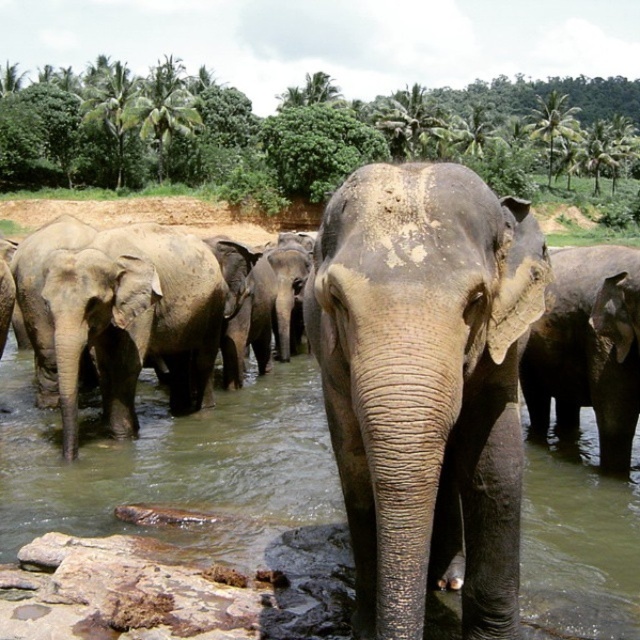
Does point (156, 314) lie in front of point (616, 474)?

No, (156, 314) is further to viewer.

Between gray matte elephant at left and gray textured elephant at center, which one appears on the left side from the viewer's perspective?

From the viewer's perspective, gray matte elephant at left appears more on the left side.

This screenshot has height=640, width=640. I want to click on gray matte elephant at left, so click(x=134, y=321).

The image size is (640, 640). Identify the location of gray matte elephant at left. (134, 321).

Does gray matte elephant at center have a greater width compared to brown muddy water at center?

Yes, gray matte elephant at center is wider than brown muddy water at center.

Does point (317, 252) come closer to viewer compared to point (205, 490)?

Yes, it is in front of point (205, 490).

Which is in front, point (417, 541) or point (524, 525)?

Positioned in front is point (417, 541).

You are a GUI agent. You are given a task and a screenshot of the screen. Output one action in this format:
    pyautogui.click(x=<x>, y=<y>)
    Task: Click on the gray matte elephant at center
    The height and width of the screenshot is (640, 640).
    Given the screenshot: What is the action you would take?
    pyautogui.click(x=426, y=387)

Can you confirm if gray matte elephant at center is wider than gray matte elephant at left?

No.

Does point (333, 394) lie behind point (196, 289)?

No, it is in front of (196, 289).

Between point (339, 472) and point (102, 317), which one is positioned in front?

Positioned in front is point (339, 472).

Identify the location of gray matte elephant at center. Image resolution: width=640 pixels, height=640 pixels. (426, 387).